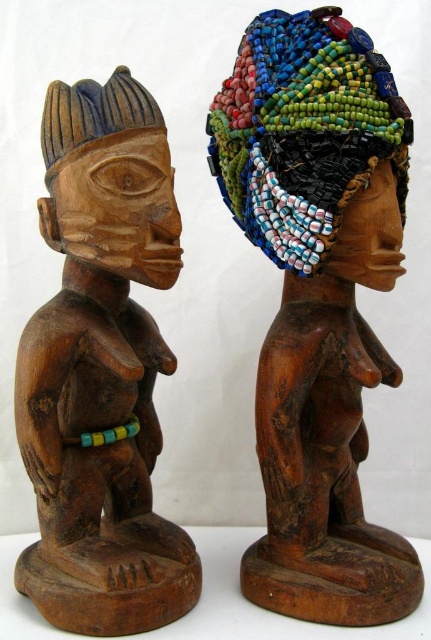
Is point (287, 518) closer to camera compared to point (124, 259)?

No, (287, 518) is behind (124, 259).

Is point (303, 22) behind point (75, 128)?

Yes, it is.

At what (x,y) coordinates should I click in order to perform the action: click on beaded wood statue at center. Please return your answer as a coordinate pair (x, y). Looking at the image, I should click on (318, 301).

Does beaded wood statue at center have a greater height compared to wooden statue at center?

Correct, beaded wood statue at center is much taller as wooden statue at center.

Does beaded wood statue at center come in front of wooden statue at center?

No, beaded wood statue at center is behind wooden statue at center.

This screenshot has height=640, width=431. What do you see at coordinates (318, 301) in the screenshot? I see `beaded wood statue at center` at bounding box center [318, 301].

Where is `beaded wood statue at center`? The width and height of the screenshot is (431, 640). beaded wood statue at center is located at coordinates (318, 301).

Is beaded/multicolored headdress at upper right wider than wooden carving at left?

Yes, beaded/multicolored headdress at upper right is wider than wooden carving at left.

Is beaded/multicolored headdress at upper right above wooden carving at left?

Yes.

Does point (255, 243) lie behind point (68, 204)?

Yes.

Image resolution: width=431 pixels, height=640 pixels. In order to click on beaded/multicolored headdress at upper right in this screenshot , I will do `click(303, 131)`.